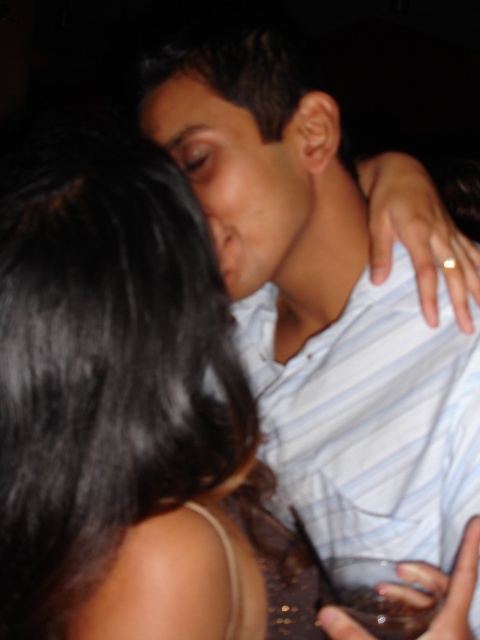
You are a photographer trying to capture a candid shot of the two people in the scene. You want to ensure that both the white striped shirt at center and the matte skin forehead at upper center are clearly visible in the frame. Given their sizes, which object should you prioritize framing first to ensure it doesn

The white striped shirt at center should be prioritized because its width is larger than the matte skin forehead at upper center, making it easier to frame while still capturing the smaller matte skin forehead at upper center in the shot.

You are a photographer trying to capture the man in the white striped shirt at center and the woman with the matte skin forehead at upper center. Can you adjust your camera to focus on both subjects equally without one blocking the other?

The white striped shirt at center is in front of the matte skin forehead at upper center, so focusing on both equally would be difficult as the shirt is blocking part of the forehead. Adjust the angle to avoid overlap.

You are a photographer trying to capture a candid shot of the white striped shirt at center and the matte skin forehead at upper center. Since you want to ensure both subjects are in focus, which object should you prioritize focusing on first based on their positions?

The white striped shirt at center is to the right of matte skin forehead at upper center, so you should focus on the matte skin forehead at upper center first as it is closer to the camera.